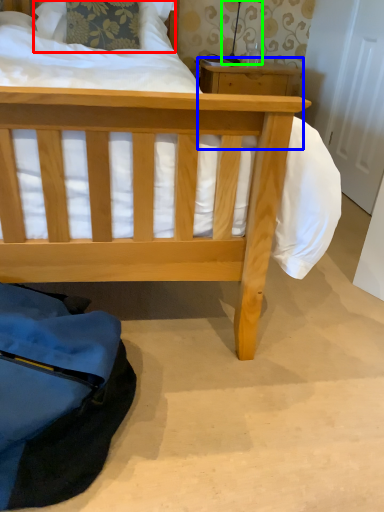
Question: Which object is the closest to the pillow (highlighted by a red box)? Choose among these: table (highlighted by a blue box) or table lamp (highlighted by a green box).

Choices:
 (A) table
 (B) table lamp

Answer: (B)